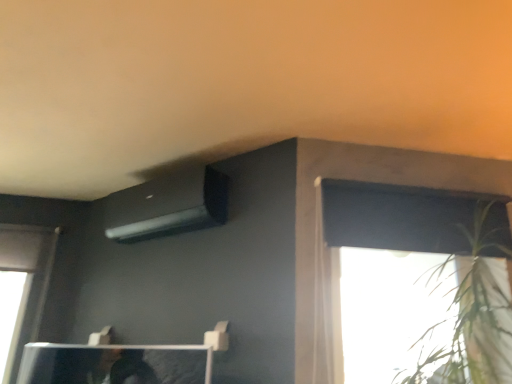
Question: Which is correct: black matte air conditioner at upper center is inside green leafy plant at upper right, or outside of it?

Choices:
 (A) outside
 (B) inside

Answer: (A)

Question: In terms of width, does black matte air conditioner at upper center look wider or thinner when compared to green leafy plant at upper right?

Choices:
 (A) thin
 (B) wide

Answer: (A)

Question: Based on their relative distances, which object is farther from the green leafy plant at upper right?

Choices:
 (A) black matte air conditioner at upper center
 (B) white sheer curtain at upper right

Answer: (A)

Question: Considering the real-world distances, which object is closest to the green leafy plant at upper right?

Choices:
 (A) white sheer curtain at upper right
 (B) black matte air conditioner at upper center

Answer: (A)